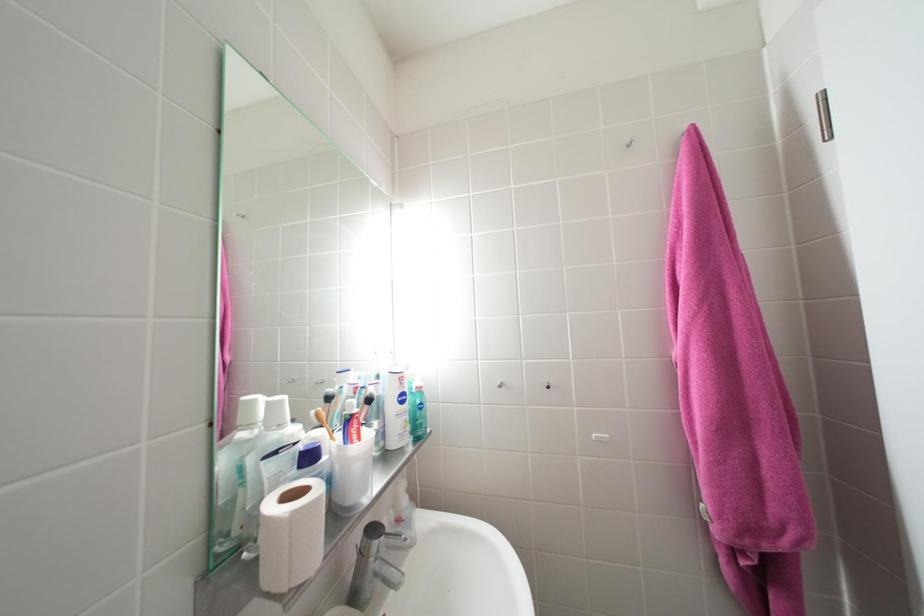
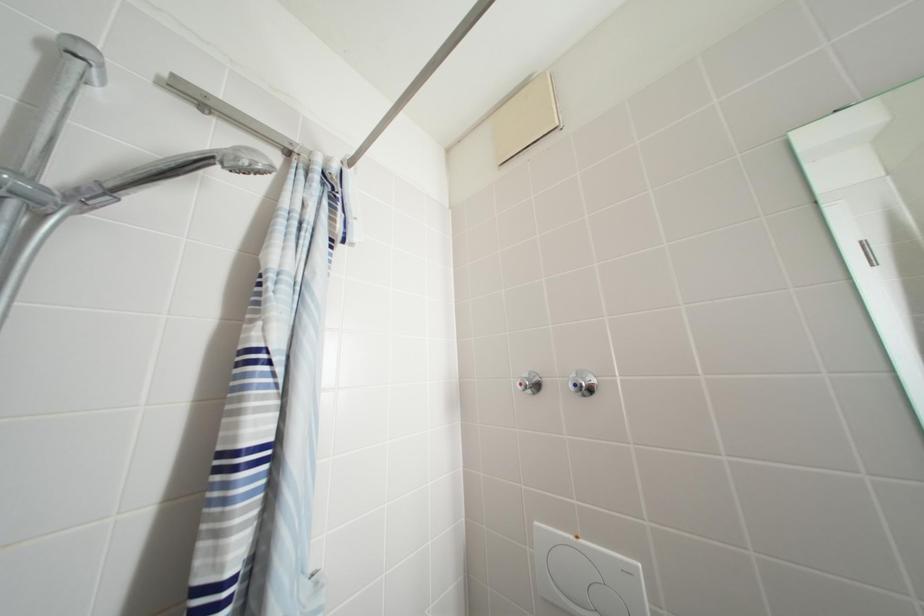
Question: The camera is either moving clockwise (left) or counter-clockwise (right) around the object. The first image is from the beginning of the video and the second image is from the end. Is the camera moving left or right when shooting the video?

Choices:
 (A) Left
 (B) Right

Answer: (B)